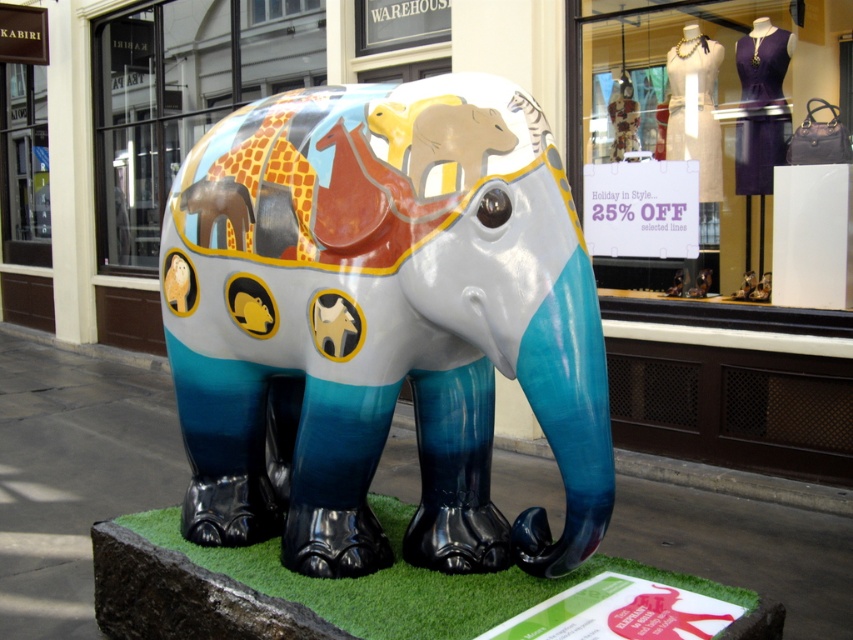
You are a delivery person trying to place a package on the surface where the shiny painted elephant at center is standing. Can you put the package on the green artificial turf at lower center without moving the elephant?

The shiny painted elephant at center is in front of green artificial turf at lower center, meaning the elephant is blocking access to the turf. Therefore, you cannot place the package on the green artificial turf at lower center without moving the elephant.

You are a delivery person trying to determine if your 1.8 meters wide delivery box can fit between the matte painted elephant at center and the green artificial turf at lower center. Can it fit?

The matte painted elephant at center is taller than the green artificial turf at lower center, but the question is about width. Since the description only mentions height comparison, there is insufficient information to determine if the 1.8 meters wide delivery box can fit between them.

You are standing in front of the retail store and want to place a small flower pot between the matte painted elephant at center and the green artificial turf at lower center. Based on their positions, which side of the elephant should you place it on?

The matte painted elephant at center is to the left of the green artificial turf at lower center, so you should place the flower pot to the right side of the matte painted elephant at center to position it between them.